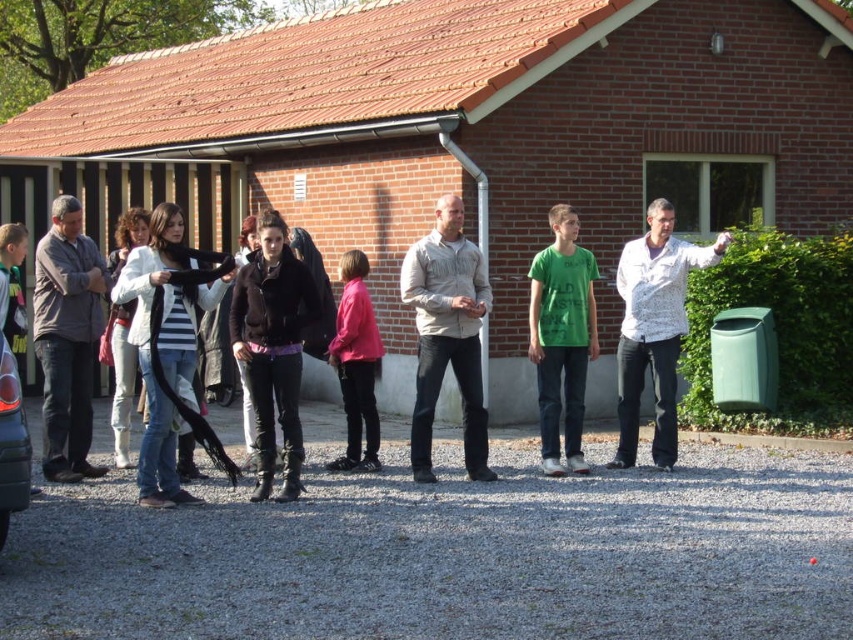
Does beige cotton shirt at center have a greater height compared to dark gray textured jacket at left?

Yes, beige cotton shirt at center is taller than dark gray textured jacket at left.

Between point (440, 353) and point (53, 372), which one is positioned in front?

Point (53, 372)

Based on the photo, measure the distance between beige cotton shirt at center and camera.

8.64 meters

You are a GUI agent. You are given a task and a screenshot of the screen. Output one action in this format:
    pyautogui.click(x=<x>, y=<y>)
    Task: Click on the beige cotton shirt at center
    The image size is (853, 640).
    Given the screenshot: What is the action you would take?
    pyautogui.click(x=447, y=333)

Between beige cotton shirt at center and black glossy car at left, which one has more height?

Standing taller between the two is beige cotton shirt at center.

Who is shorter, beige cotton shirt at center or black glossy car at left?

Standing shorter between the two is black glossy car at left.

Is point (422, 316) closer to camera compared to point (16, 396)?

No, it is not.

The image size is (853, 640). What are the coordinates of `beige cotton shirt at center` in the screenshot? It's located at (447, 333).

Between white textured shirt at right and black glossy car at left, which one appears on the right side from the viewer's perspective?

Positioned to the right is white textured shirt at right.

Who is more forward, (622, 392) or (4, 413)?

Point (4, 413)

What are the coordinates of `white textured shirt at right` in the screenshot? It's located at (654, 328).

You are a GUI agent. You are given a task and a screenshot of the screen. Output one action in this format:
    pyautogui.click(x=<x>, y=<y>)
    Task: Click on the white textured shirt at right
    
    Given the screenshot: What is the action you would take?
    pyautogui.click(x=654, y=328)